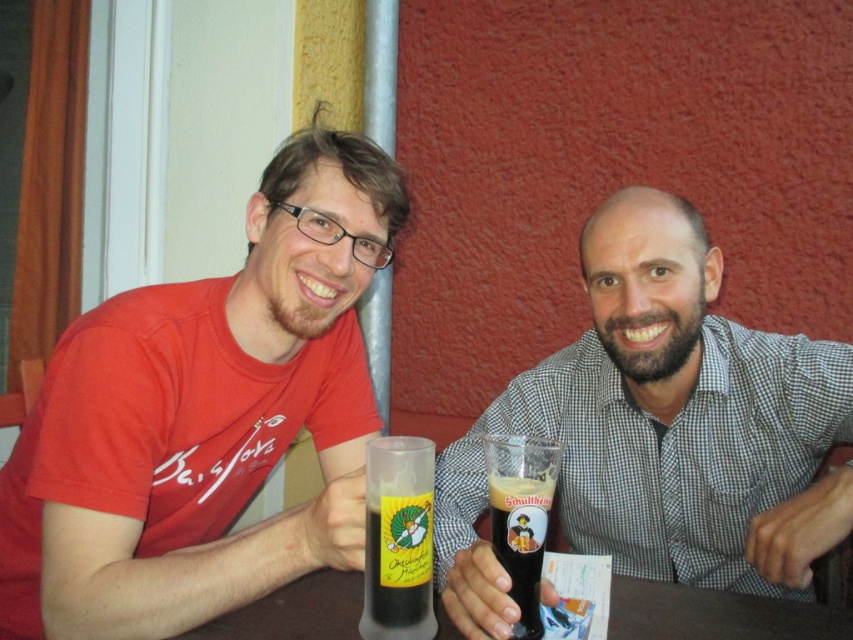
You are at a party and want to grab a drink quickly. There is a matte plastic cup at center and a translucent glass bottle at center. Which one is easier to reach if you are standing directly in front of both?

Both the matte plastic cup at center and the translucent glass bottle at center are 11.01 inches apart. Since you are standing directly in front of both, the distance between them means you can reach either one depending on your arm length, but the question doesn answer which is closer. However, since they are at the same center position, they might be aligned vertically or horizontally. Without more info, it can be assumed they are equally reachable if centered.

You are a bartender who needs to place a new drink on the table. The drink must be placed exactly where the matte glass beer at center is currently located. Can you confirm if there is enough space on the translucent plastic table at center to place the new drink without overlapping the existing one?

The matte glass beer at center is located above the translucent plastic table at center, so there is enough space to place the new drink in the same spot without overlapping.

You are at a bar and want to order a drink. You see two glasses at the table in front of you. Which one is taller, the matte glass beer at center or the dark brown glass at center?

The matte glass beer at center is taller than the dark brown glass at center.